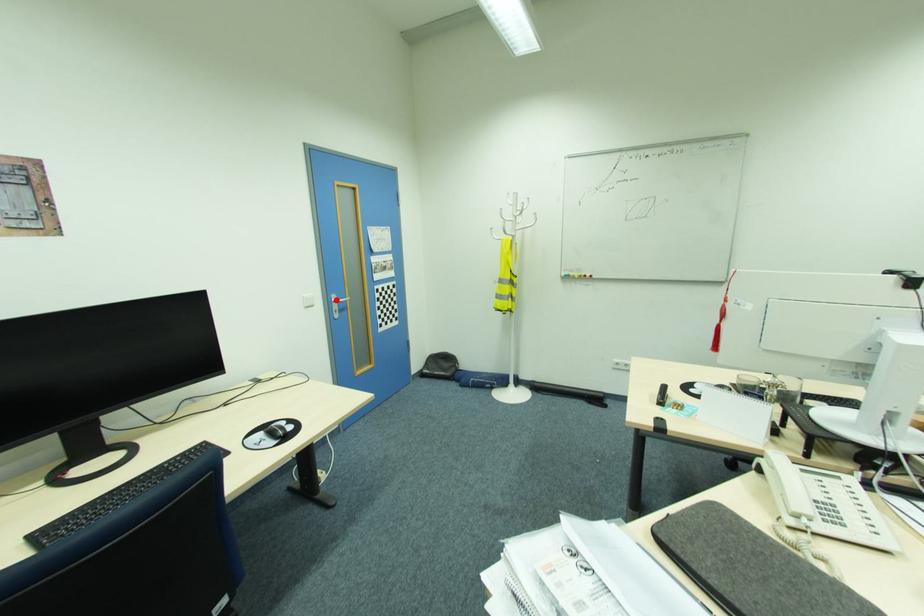
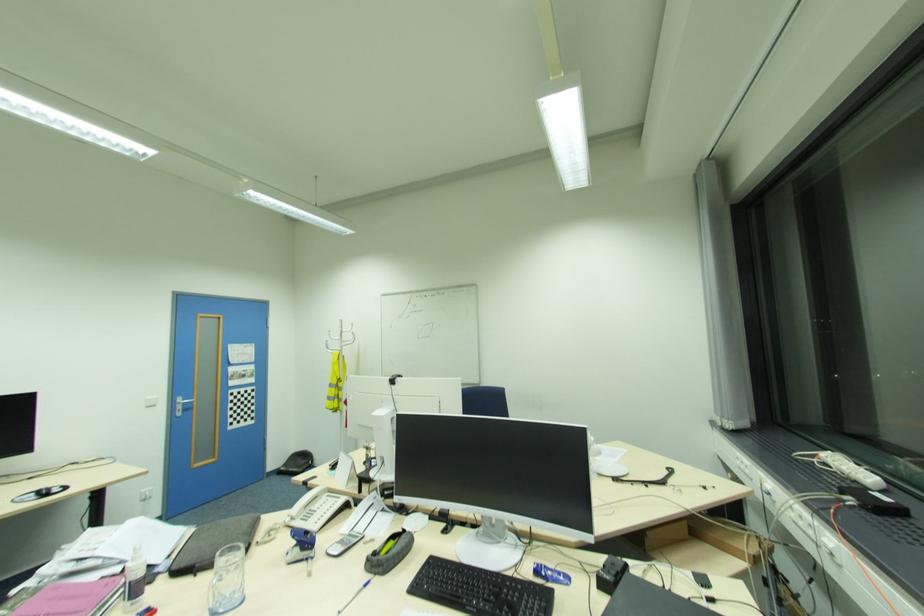
Question: I am providing you with two images of the same scene from different viewpoints. A red point is marked on the first image. Can you still see the location of the red point in image 2?

Choices:
 (A) Yes
 (B) No

Answer: (A)